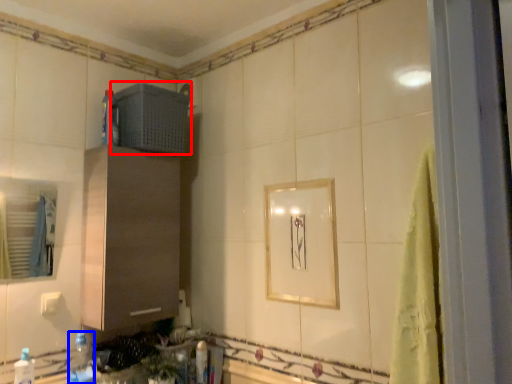
Question: Among these objects, which one is farthest to the camera, appliance (highlighted by a red box) or bottle (highlighted by a blue box)?

Choices:
 (A) appliance
 (B) bottle

Answer: (A)